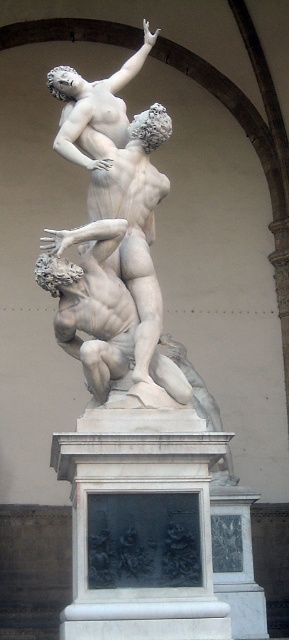
In the scene shown: Does white marble statue at center lie in front of white marble statue at upper center?

Yes, white marble statue at center is closer to the viewer.

Can you confirm if white marble statue at center is positioned above white marble statue at upper center?

Actually, white marble statue at center is below white marble statue at upper center.

At what (x,y) coordinates should I click in order to perform the action: click on white marble statue at center. Please return your answer as a coordinate pair (x, y). This screenshot has width=289, height=640. Looking at the image, I should click on (91, 301).

Between point (208, 502) and point (113, 294), which one is positioned in front?

Point (208, 502) is more forward.

Is white marble relief at center shorter than white marble statue at center?

No.

Does point (104, 454) lie behind point (84, 362)?

No.

Locate an element on the screen. white marble relief at center is located at coordinates (141, 534).

This screenshot has height=640, width=289. Identify the location of white marble relief at center. click(141, 534).

Does white marble relief at center have a lesser width compared to white marble statue at upper center?

Incorrect, white marble relief at center's width is not less than white marble statue at upper center's.

Which is behind, point (93, 602) or point (87, 164)?

Positioned behind is point (87, 164).

Where is `white marble relief at center`? The image size is (289, 640). white marble relief at center is located at coordinates (141, 534).